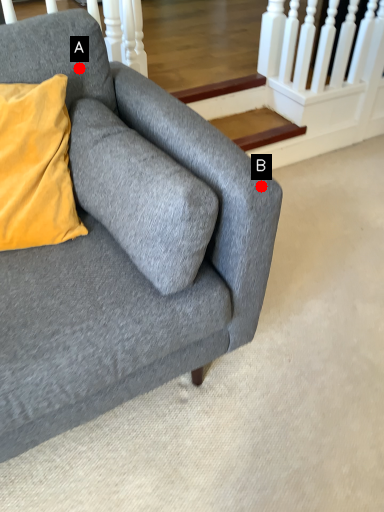
Question: Two points are circled on the image, labeled by A and B beside each circle. Which point is closer to the camera taking this photo?

Choices:
 (A) A is closer
 (B) B is closer

Answer: (B)